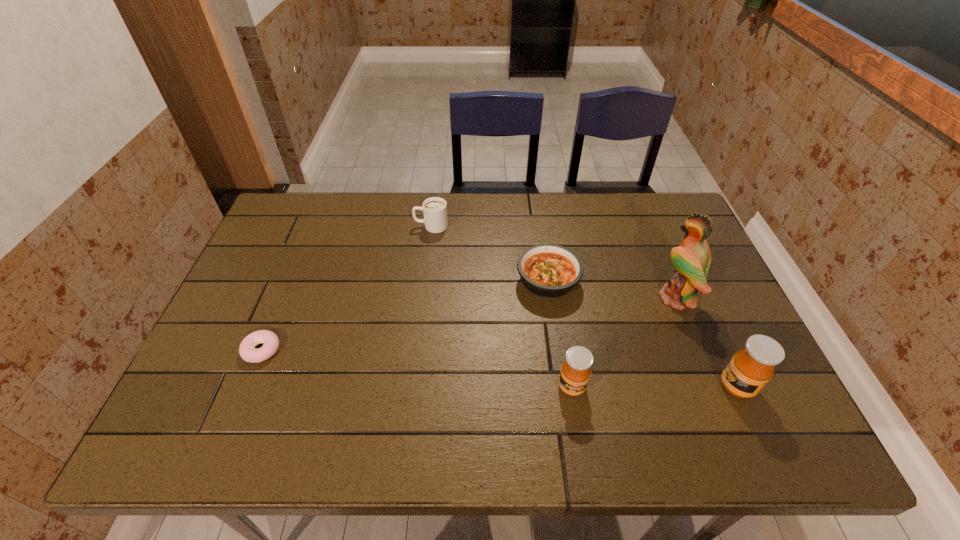
Locate an element on the screen. vacant space located 0.190m on the front-facing side of the taller honey is located at coordinates tap(636, 387).

You are a GUI agent. You are given a task and a screenshot of the screen. Output one action in this format:
    pyautogui.click(x=<x>, y=<y>)
    Task: Click on the free point located on the front-facing side of the taller honey
    
    Given the screenshot: What is the action you would take?
    pyautogui.click(x=623, y=387)

What are the coordinates of `vacant region located 0.140m on the front-facing side of the taller honey` in the screenshot? It's located at (659, 387).

This screenshot has width=960, height=540. I want to click on blank area located on the side with the handle of the farthest object, so click(355, 226).

Image resolution: width=960 pixels, height=540 pixels. Find the location of `vacant area situated on the side with the handle of the farthest object`. vacant area situated on the side with the handle of the farthest object is located at coordinates (383, 226).

Locate an element on the screen. vacant space situated on the side with the handle of the farthest object is located at coordinates (340, 226).

Image resolution: width=960 pixels, height=540 pixels. What are the coordinates of `vacant space located 0.140m on the front-facing side of the tallest object` in the screenshot? It's located at pyautogui.click(x=605, y=298).

Image resolution: width=960 pixels, height=540 pixels. I want to click on vacant space located 0.240m on the front-facing side of the tallest object, so click(x=568, y=298).

Image resolution: width=960 pixels, height=540 pixels. What are the coordinates of `vacant space situated 0.160m on the front-facing side of the tallest object` in the screenshot? It's located at (597, 298).

Where is `blank space located on the right of the third nearest object`? blank space located on the right of the third nearest object is located at coordinates (324, 350).